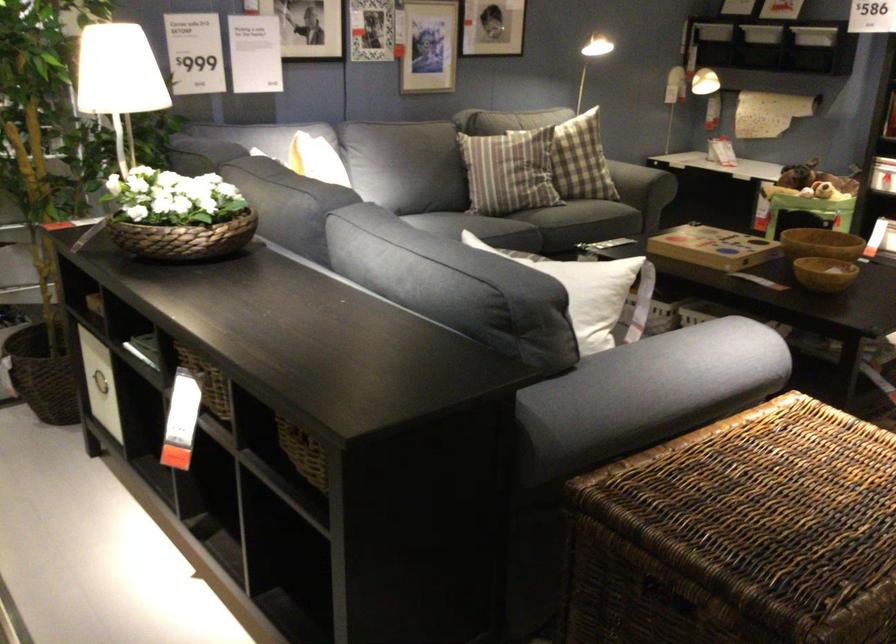
Which object does [507,172] point to?

This point indicates the plaid pillow.